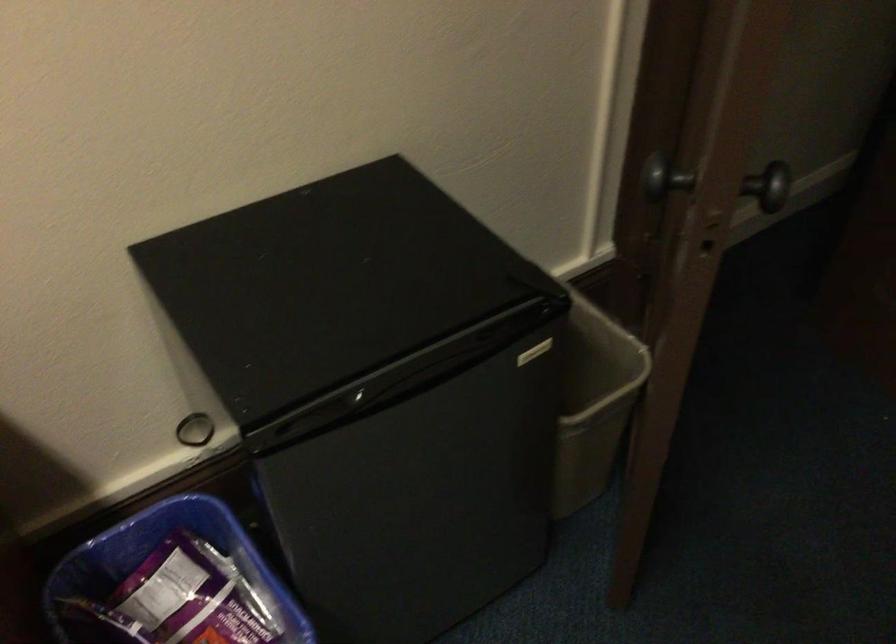
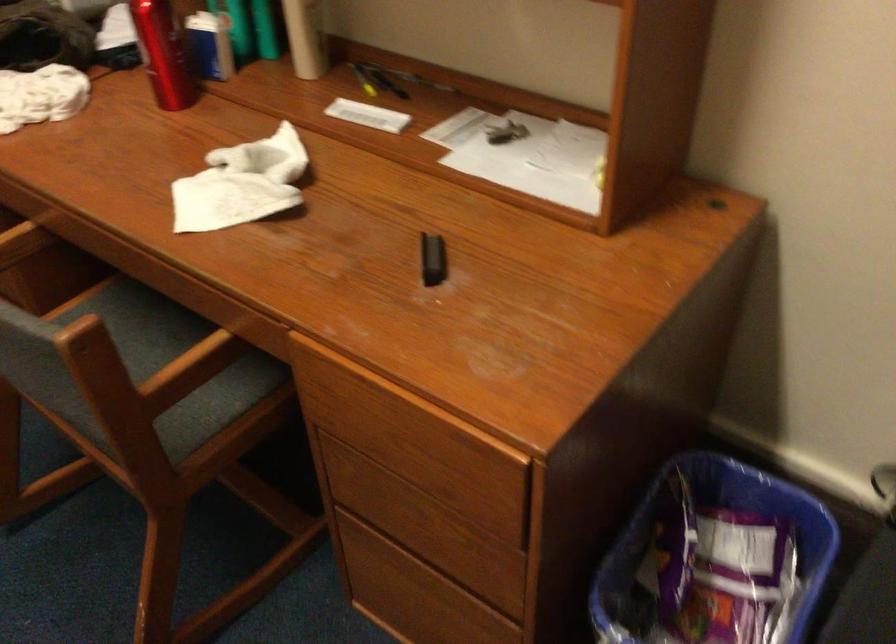
Consider the image. First-person continuous shooting, in which direction is the camera rotating?

The camera rotated toward left-down.